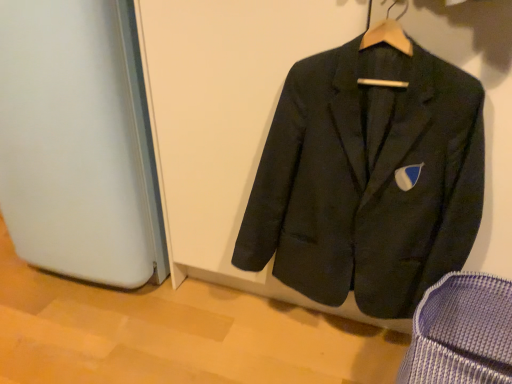
Where is `matte black suit at center`? Image resolution: width=512 pixels, height=384 pixels. matte black suit at center is located at coordinates (368, 179).

What do you see at coordinates (368, 179) in the screenshot? I see `matte black suit at center` at bounding box center [368, 179].

Identify the location of textured blue fabric armchair at lower right. This screenshot has height=384, width=512. (461, 333).

This screenshot has width=512, height=384. What do you see at coordinates (461, 333) in the screenshot?
I see `textured blue fabric armchair at lower right` at bounding box center [461, 333].

Find the location of a particular element. This screenshot has height=384, width=512. matte black suit at center is located at coordinates (368, 179).

Can you confirm if textured blue fabric armchair at lower right is positioned to the right of matte black suit at center?

Indeed, textured blue fabric armchair at lower right is positioned on the right side of matte black suit at center.

Is textured blue fabric armchair at lower right closer to camera compared to matte black suit at center?

Yes.

Considering the positions of points (502, 282) and (351, 273), is point (502, 282) closer to camera compared to point (351, 273)?

Yes, point (502, 282) is closer to viewer.

From the image's perspective, relative to matte black suit at center, is textured blue fabric armchair at lower right above or below?

textured blue fabric armchair at lower right is below matte black suit at center.

From a real-world perspective, which is physically below, textured blue fabric armchair at lower right or matte black suit at center?

textured blue fabric armchair at lower right is physically lower.

Can you confirm if textured blue fabric armchair at lower right is wider than matte black suit at center?

Yes.

Is textured blue fabric armchair at lower right shorter than matte black suit at center?

Yes, textured blue fabric armchair at lower right is shorter than matte black suit at center.

Based on the photo, is textured blue fabric armchair at lower right bigger than matte black suit at center?

No.

Is textured blue fabric armchair at lower right surrounding matte black suit at center?

Actually, matte black suit at center is outside textured blue fabric armchair at lower right.

Would you consider textured blue fabric armchair at lower right to be distant from matte black suit at center?

textured blue fabric armchair at lower right is near matte black suit at center, not far away.

Is textured blue fabric armchair at lower right aimed at matte black suit at center?

No.

From the picture: Can you tell me how much textured blue fabric armchair at lower right and matte black suit at center differ in facing direction?

textured blue fabric armchair at lower right and matte black suit at center are facing 18.3 degrees away from each other.

Where is `armchair to the right of matte black suit at center`? The image size is (512, 384). armchair to the right of matte black suit at center is located at coordinates (461, 333).

Does matte black suit at center appear on the right side of textured blue fabric armchair at lower right?

Incorrect, matte black suit at center is not on the right side of textured blue fabric armchair at lower right.

Between matte black suit at center and textured blue fabric armchair at lower right, which one is positioned in front?

textured blue fabric armchair at lower right is closer to the camera.

Is point (426, 182) behind point (438, 383)?

Yes, it is behind point (438, 383).

From the image's perspective, which is above, matte black suit at center or textured blue fabric armchair at lower right?

From the image's view, matte black suit at center is above.

From a real-world perspective, is matte black suit at center physically above textured blue fabric armchair at lower right?

Result: Indeed, from a real-world perspective, matte black suit at center stands above textured blue fabric armchair at lower right.

Does matte black suit at center have a lesser width compared to textured blue fabric armchair at lower right?

Correct, the width of matte black suit at center is less than that of textured blue fabric armchair at lower right.

Considering the relative sizes of matte black suit at center and textured blue fabric armchair at lower right in the image provided, is matte black suit at center shorter than textured blue fabric armchair at lower right?

No, matte black suit at center is not shorter than textured blue fabric armchair at lower right.

Considering the sizes of objects matte black suit at center and textured blue fabric armchair at lower right in the image provided, who is smaller, matte black suit at center or textured blue fabric armchair at lower right?

With smaller size is textured blue fabric armchair at lower right.

Is matte black suit at center inside the boundaries of textured blue fabric armchair at lower right, or outside?

matte black suit at center exists outside the volume of textured blue fabric armchair at lower right.

Is matte black suit at center not close to textured blue fabric armchair at lower right?

No, matte black suit at center is not far from textured blue fabric armchair at lower right.

Is matte black suit at center oriented away from textured blue fabric armchair at lower right?

That's not correct — matte black suit at center is not looking away from textured blue fabric armchair at lower right.

How distant is matte black suit at center from textured blue fabric armchair at lower right?

matte black suit at center and textured blue fabric armchair at lower right are 11.28 inches apart from each other.

Find the location of a particular element. armchair on the right of matte black suit at center is located at coordinates (461, 333).

At what (x,y) coordinates should I click in order to perform the action: click on armchair located in front of the matte black suit at center. Please return your answer as a coordinate pair (x, y). The image size is (512, 384). Looking at the image, I should click on (461, 333).

Identify the location of armchair located on the right of matte black suit at center. (461, 333).